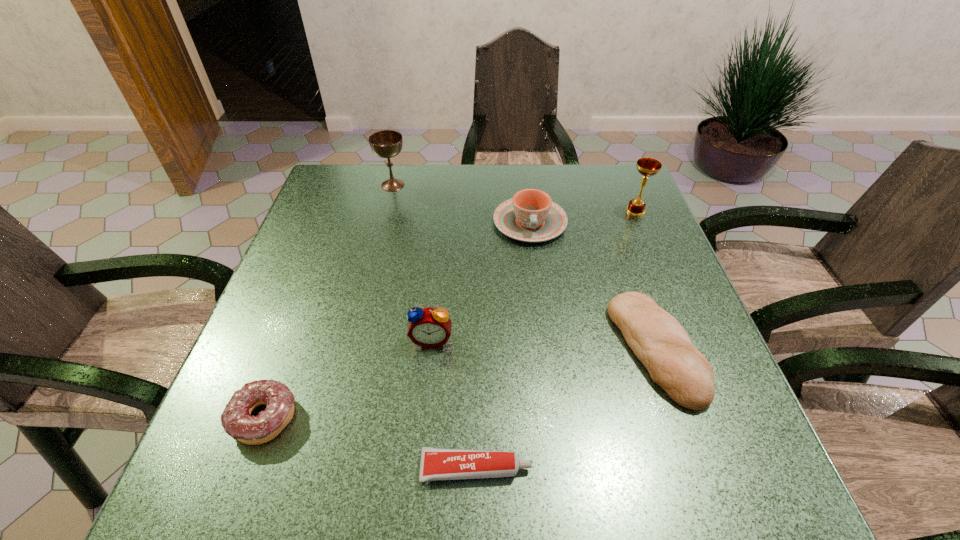
Locate an element on the screen. Image resolution: width=960 pixels, height=540 pixels. the farthest object is located at coordinates (386, 144).

The height and width of the screenshot is (540, 960). I want to click on the farther chalice, so click(386, 144).

The image size is (960, 540). I want to click on the nearer chalice, so click(647, 167).

Locate an element on the screen. The width and height of the screenshot is (960, 540). alarm clock is located at coordinates (428, 327).

Find the location of `chinaware`. chinaware is located at coordinates (530, 216).

This screenshot has height=540, width=960. Find the location of `the fifth tallest object`. the fifth tallest object is located at coordinates (657, 339).

Find the location of `doughnut`. doughnut is located at coordinates (236, 419).

You are a GUI agent. You are given a task and a screenshot of the screen. Output one action in this format:
    pyautogui.click(x=<x>, y=<y>)
    Task: Click on the leftmost object
    
    Given the screenshot: What is the action you would take?
    pyautogui.click(x=236, y=419)

Where is `the nearest object`? the nearest object is located at coordinates (436, 464).

Find the location of a particular element. Image resolution: width=960 pixels, height=540 pixels. the shortest object is located at coordinates (436, 464).